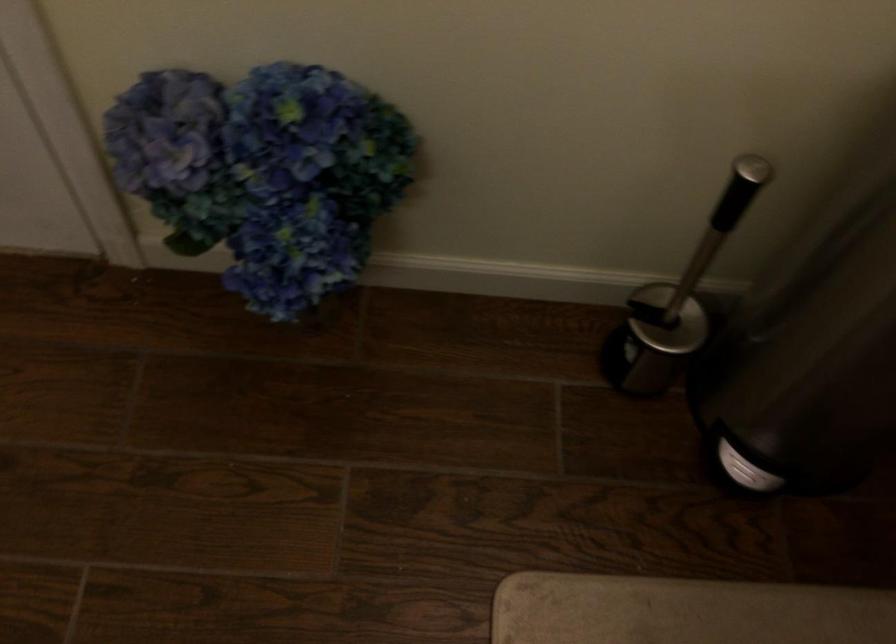
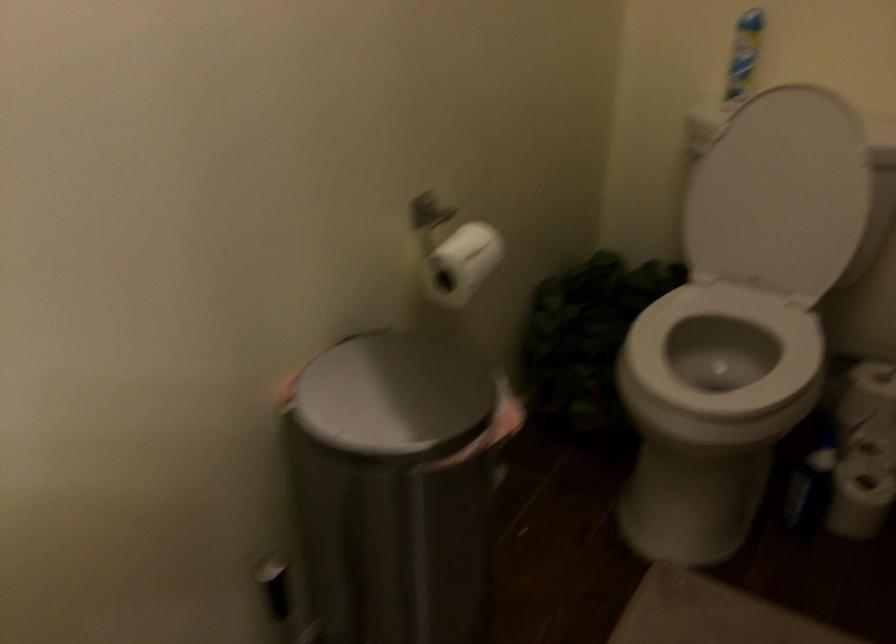
Question: The camera is either moving clockwise (left) or counter-clockwise (right) around the object. The first image is from the beginning of the video and the second image is from the end. Is the camera moving left or right when shooting the video?

Choices:
 (A) Left
 (B) Right

Answer: (A)